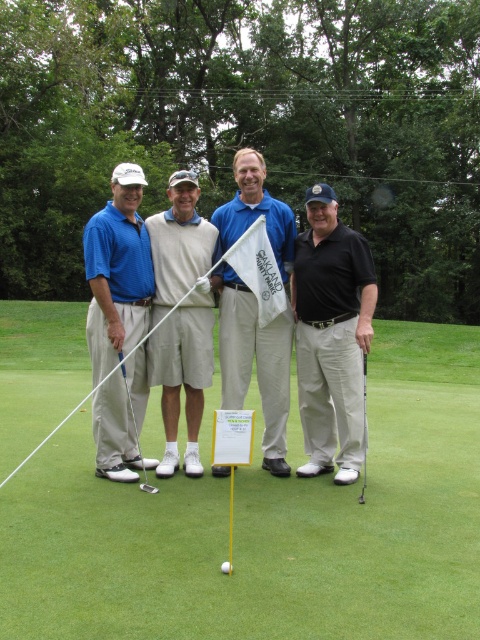
Question: Estimate the real-world distances between objects in this image. Which object is closer to the white cotton shorts at center?

Choices:
 (A) shiny silver putter at lower left
 (B) white matte golf ball at center
 (C) blue cotton polo shirt at center
 (D) matte blue shirt at left

Answer: (A)

Question: Which object is the farthest from the black matte golf club at center?

Choices:
 (A) white cotton shorts at center
 (B) blue cotton polo shirt at center
 (C) metallic silver putter at center
 (D) matte blue shirt at left

Answer: (D)

Question: Does matte blue shirt at left have a larger size compared to white matte golf ball at center?

Choices:
 (A) yes
 (B) no

Answer: (A)

Question: Based on their relative distances, which object is farther from the green grass at center?

Choices:
 (A) blue cotton polo shirt at center
 (B) matte blue shirt at left
 (C) metallic silver golf club at center

Answer: (B)

Question: In this image, where is shiny silver putter at lower left located relative to metallic silver golf club at center?

Choices:
 (A) right
 (B) left

Answer: (B)

Question: Can you confirm if green grass at center is positioned above black matte golf club at center?

Choices:
 (A) no
 (B) yes

Answer: (A)